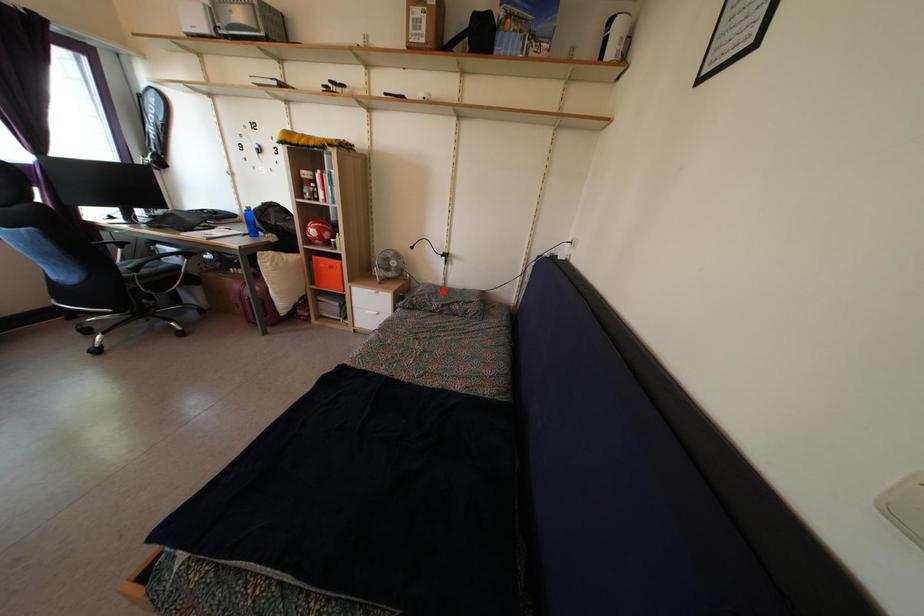
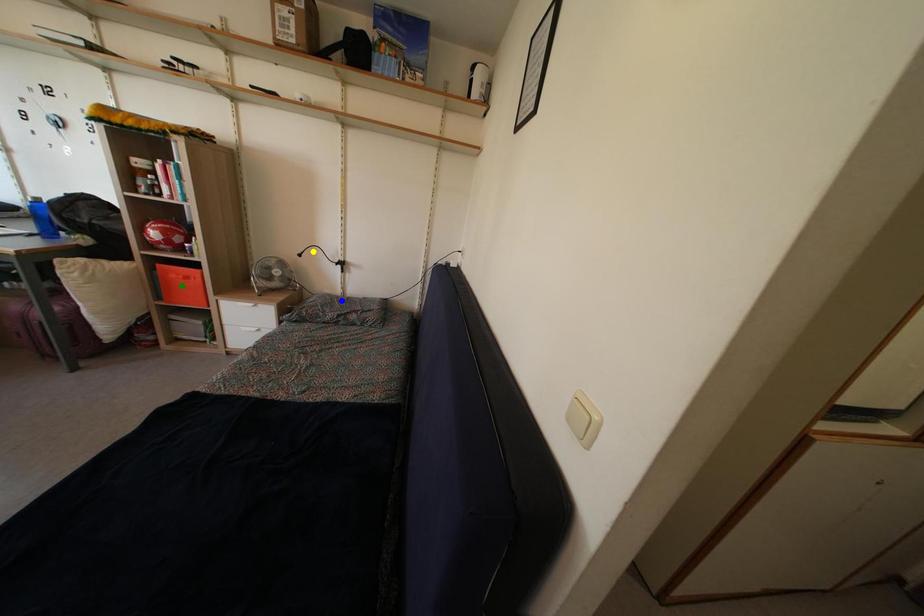
Question: I am providing you with two images of the same scene from different viewpoints. A red point is marked on the first image. You are given multiple points on the second image. Which point in image 2 represents the same 3d spot as the red point in image 1?

Choices:
 (A) green point
 (B) blue point
 (C) yellow point

Answer: (B)